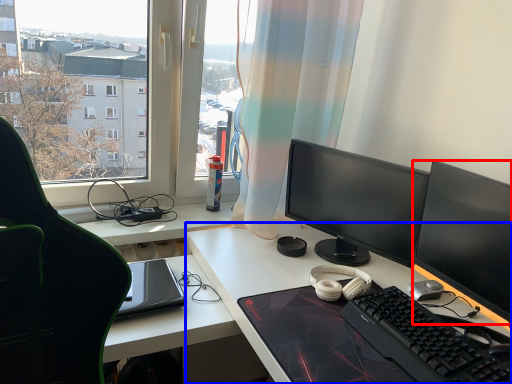
Question: Which of the following is the farthest to the observer, computer monitor (highlighted by a red box) or desk (highlighted by a blue box)?

Choices:
 (A) computer monitor
 (B) desk

Answer: (A)